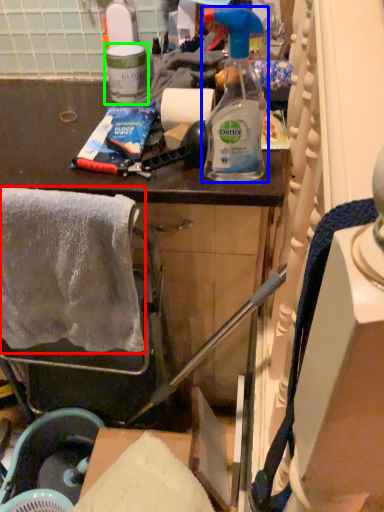
Question: Based on their relative distances, which object is nearer to towel/napkin (highlighted by a red box)? Choose from bottle (highlighted by a blue box) and bottle (highlighted by a green box).

Choices:
 (A) bottle
 (B) bottle

Answer: (A)